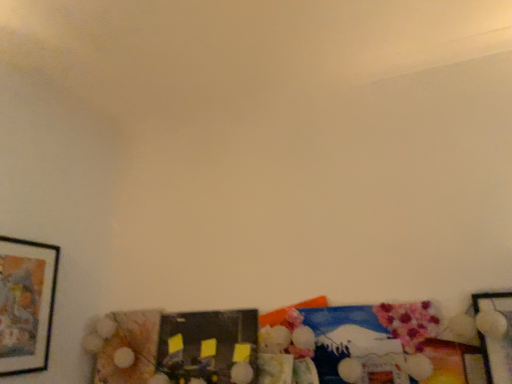
The image size is (512, 384). I want to click on matte black picture frame at center, the second picture frame from the right, so click(207, 345).

Locate an element on the screen. This screenshot has width=512, height=384. metallic silver picture frame at lower right, marked as the first picture frame in a right-to-left arrangement is located at coordinates (496, 336).

Where is `matte black picture frame at left, the 1th picture frame from the left`? matte black picture frame at left, the 1th picture frame from the left is located at coordinates (26, 304).

What do you see at coordinates (26, 304) in the screenshot? I see `matte black picture frame at left, the 1th picture frame from the left` at bounding box center [26, 304].

Where is `matte black picture frame at center, the second picture frame from the right`? matte black picture frame at center, the second picture frame from the right is located at coordinates (207, 345).

Considering the sizes of metallic silver picture frame at lower right, marked as the first picture frame in a right-to-left arrangement, and matte black picture frame at left, the 1th picture frame from the left, in the image, is metallic silver picture frame at lower right, marked as the first picture frame in a right-to-left arrangement, wider or thinner than matte black picture frame at left, the 1th picture frame from the left,?

Considering their sizes, metallic silver picture frame at lower right, marked as the first picture frame in a right-to-left arrangement, looks broader than matte black picture frame at left, the 1th picture frame from the left.

From a real-world perspective, which object stands above the other?

matte black picture frame at left, the 1th picture frame from the left, is physically above.

Which point is more distant from viewer, (506, 297) or (55, 258)?

Positioned behind is point (55, 258).

From a real-world perspective, is matte black picture frame at left, acting as the 3th picture frame starting from the right, located higher than matte black picture frame at center, placed as the second picture frame when sorted from left to right?

Yes.

Which of these two, matte black picture frame at left, the 1th picture frame from the left, or matte black picture frame at center, placed as the second picture frame when sorted from left to right, is smaller?

matte black picture frame at left, the 1th picture frame from the left.

Considering the relative positions of matte black picture frame at left, acting as the 3th picture frame starting from the right, and matte black picture frame at center, placed as the second picture frame when sorted from left to right, in the image provided, is matte black picture frame at left, acting as the 3th picture frame starting from the right, to the left of matte black picture frame at center, placed as the second picture frame when sorted from left to right, from the viewer's perspective?

Yes, matte black picture frame at left, acting as the 3th picture frame starting from the right, is to the left of matte black picture frame at center, placed as the second picture frame when sorted from left to right.

Does matte black picture frame at left, the 1th picture frame from the left, have a lesser width compared to matte black picture frame at center, the second picture frame from the right?

Yes.

Is the surface of matte black picture frame at center, the second picture frame from the right, in direct contact with metallic silver picture frame at lower right, the 3th picture frame positioned from the left?

matte black picture frame at center, the second picture frame from the right, is not next to metallic silver picture frame at lower right, the 3th picture frame positioned from the left, and they're not touching.

Is matte black picture frame at center, the second picture frame from the right, in front of or behind metallic silver picture frame at lower right, marked as the first picture frame in a right-to-left arrangement, in the image?

Visually, matte black picture frame at center, the second picture frame from the right, is located behind metallic silver picture frame at lower right, marked as the first picture frame in a right-to-left arrangement.

Considering the sizes of matte black picture frame at center, the second picture frame from the right, and metallic silver picture frame at lower right, the 3th picture frame positioned from the left, in the image, is matte black picture frame at center, the second picture frame from the right, wider or thinner than metallic silver picture frame at lower right, the 3th picture frame positioned from the left,?

→ In the image, matte black picture frame at center, the second picture frame from the right, appears to be more narrow than metallic silver picture frame at lower right, the 3th picture frame positioned from the left.

Is matte black picture frame at center, placed as the second picture frame when sorted from left to right, inside or outside of metallic silver picture frame at lower right, marked as the first picture frame in a right-to-left arrangement?

matte black picture frame at center, placed as the second picture frame when sorted from left to right, exists outside the volume of metallic silver picture frame at lower right, marked as the first picture frame in a right-to-left arrangement.

Is matte black picture frame at left, acting as the 3th picture frame starting from the right, directly adjacent to metallic silver picture frame at lower right, marked as the first picture frame in a right-to-left arrangement?

They are not placed beside each other.

Which of these two, matte black picture frame at left, the 1th picture frame from the left, or metallic silver picture frame at lower right, marked as the first picture frame in a right-to-left arrangement, is smaller?

metallic silver picture frame at lower right, marked as the first picture frame in a right-to-left arrangement, is smaller.

Is matte black picture frame at left, acting as the 3th picture frame starting from the right, spatially inside metallic silver picture frame at lower right, the 3th picture frame positioned from the left, or outside of it?

matte black picture frame at left, acting as the 3th picture frame starting from the right, is not inside metallic silver picture frame at lower right, the 3th picture frame positioned from the left, it's outside.

From the image's perspective, which one is positioned higher, matte black picture frame at left, acting as the 3th picture frame starting from the right, or metallic silver picture frame at lower right, marked as the first picture frame in a right-to-left arrangement?

matte black picture frame at left, acting as the 3th picture frame starting from the right.

Which is behind, metallic silver picture frame at lower right, marked as the first picture frame in a right-to-left arrangement, or matte black picture frame at center, the second picture frame from the right?

matte black picture frame at center, the second picture frame from the right.

Which picture frame is the 2nd one when counting from the front of the matte black picture frame at center, placed as the second picture frame when sorted from left to right? Please provide its 2D coordinates.

[(496, 336)]

From a real-world perspective, is metallic silver picture frame at lower right, marked as the first picture frame in a right-to-left arrangement, under matte black picture frame at center, placed as the second picture frame when sorted from left to right?

No, from a real-world perspective, metallic silver picture frame at lower right, marked as the first picture frame in a right-to-left arrangement, is not under matte black picture frame at center, placed as the second picture frame when sorted from left to right.

Is matte black picture frame at left, the 1th picture frame from the left, inside matte black picture frame at center, placed as the second picture frame when sorted from left to right?

No, matte black picture frame at left, the 1th picture frame from the left, is located outside of matte black picture frame at center, placed as the second picture frame when sorted from left to right.

Does matte black picture frame at center, placed as the second picture frame when sorted from left to right, have a smaller size compared to matte black picture frame at left, acting as the 3th picture frame starting from the right?

No, matte black picture frame at center, placed as the second picture frame when sorted from left to right, is not smaller than matte black picture frame at left, acting as the 3th picture frame starting from the right.

Can you tell me how much matte black picture frame at center, the second picture frame from the right, and matte black picture frame at left, the 1th picture frame from the left, differ in facing direction?

The angle between the facing direction of matte black picture frame at center, the second picture frame from the right, and the facing direction of matte black picture frame at left, the 1th picture frame from the left, is 90 degrees.

Which object is wider, matte black picture frame at center, placed as the second picture frame when sorted from left to right, or matte black picture frame at left, acting as the 3th picture frame starting from the right?

matte black picture frame at center, placed as the second picture frame when sorted from left to right.

Locate an element on the screen. the 2nd picture frame counting from the left side of the metallic silver picture frame at lower right, marked as the first picture frame in a right-to-left arrangement is located at coordinates (26, 304).

Locate an element on the screen. This screenshot has height=384, width=512. the 2nd picture frame below the matte black picture frame at left, acting as the 3th picture frame starting from the right (from the image's perspective) is located at coordinates (207, 345).

Considering their positions, is matte black picture frame at center, placed as the second picture frame when sorted from left to right, positioned closer to matte black picture frame at left, the 1th picture frame from the left, than metallic silver picture frame at lower right, marked as the first picture frame in a right-to-left arrangement?

matte black picture frame at center, placed as the second picture frame when sorted from left to right, lies closer to matte black picture frame at left, the 1th picture frame from the left, than the other object.

From the picture: Considering their positions, is matte black picture frame at left, acting as the 3th picture frame starting from the right, positioned further to matte black picture frame at center, the second picture frame from the right, than metallic silver picture frame at lower right, marked as the first picture frame in a right-to-left arrangement?

Based on the image, metallic silver picture frame at lower right, marked as the first picture frame in a right-to-left arrangement, appears to be further to matte black picture frame at center, the second picture frame from the right.

Considering their positions, is metallic silver picture frame at lower right, marked as the first picture frame in a right-to-left arrangement, positioned further to matte black picture frame at center, the second picture frame from the right, than matte black picture frame at left, acting as the 3th picture frame starting from the right?

The object further to matte black picture frame at center, the second picture frame from the right, is metallic silver picture frame at lower right, marked as the first picture frame in a right-to-left arrangement.

When comparing their distances from metallic silver picture frame at lower right, marked as the first picture frame in a right-to-left arrangement, does matte black picture frame at left, acting as the 3th picture frame starting from the right, or matte black picture frame at center, the second picture frame from the right, seem further?

matte black picture frame at left, acting as the 3th picture frame starting from the right, lies further to metallic silver picture frame at lower right, marked as the first picture frame in a right-to-left arrangement, than the other object.

When comparing their distances from metallic silver picture frame at lower right, the 3th picture frame positioned from the left, does matte black picture frame at center, placed as the second picture frame when sorted from left to right, or matte black picture frame at left, acting as the 3th picture frame starting from the right, seem closer?

matte black picture frame at center, placed as the second picture frame when sorted from left to right.

Looking at the image, which one is located further to matte black picture frame at left, the 1th picture frame from the left, metallic silver picture frame at lower right, the 3th picture frame positioned from the left, or matte black picture frame at center, the second picture frame from the right?

The object further to matte black picture frame at left, the 1th picture frame from the left, is metallic silver picture frame at lower right, the 3th picture frame positioned from the left.

Find the location of a particular element. The image size is (512, 384). picture frame located between matte black picture frame at left, acting as the 3th picture frame starting from the right, and metallic silver picture frame at lower right, marked as the first picture frame in a right-to-left arrangement, in the left-right direction is located at coordinates (207, 345).